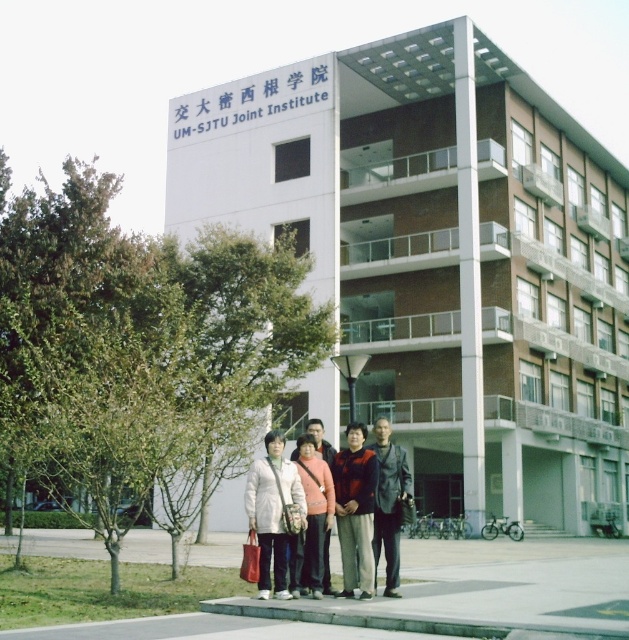
You are a photographer standing at the entrance of the UM SJTU Joint Institute building. You want to take a photo of the matte white coat at center. Where should you position your camera to capture the coat in the center of the frame?

The matte white coat at center is already positioned at point (274, 513), so you should aim your camera to that coordinate to capture it in the center of the frame.

You are a photographer standing in front of the UM SJTU Joint Institute building. You notice two people wearing a dark red sweater at center and a matte pink sweater at center. If you want to take a photo that includes both sweaters in the frame, which sweater should you focus on first to ensure both are visible?

The dark red sweater at center is to the right of the matte pink sweater at center. To include both in the frame, focus on the matte pink sweater at center first since it is on the left, allowing the camera to capture both sweaters as you adjust the frame to the right.

Looking at this image, you are a photographer standing in front of the UM SJTU Joint Institute building. You notice two people wearing a matte pink sweater at center and a dark gray leather jacket at center. Which clothing item is closer to the ground?

The matte pink sweater at center is positioned under the dark gray leather jacket at center, so the matte pink sweater at center is closer to the ground.